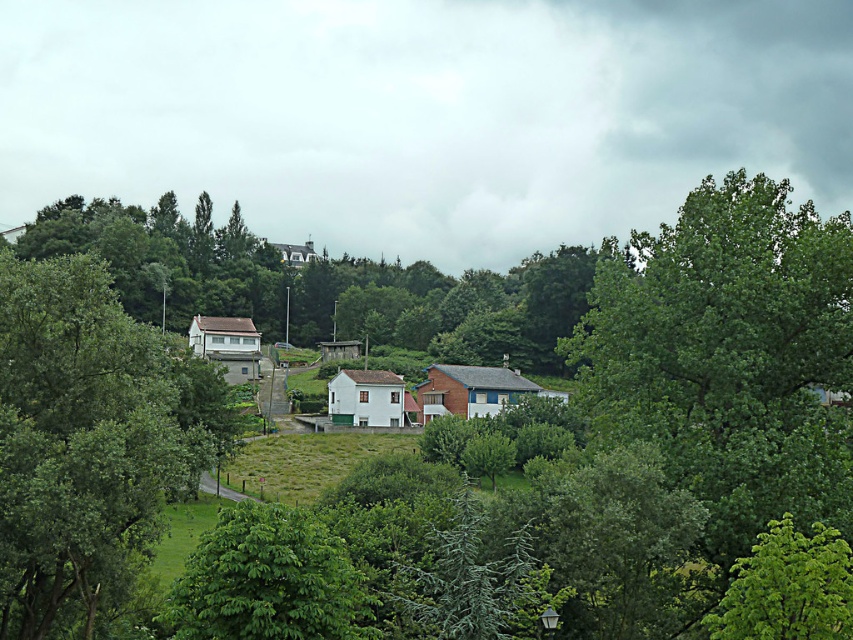
You are a hiker planning to take a photo of the green leafy tree at center and the green leafy tree at lower right from the path. Which tree should you stand closer to in order to capture both trees in the same frame without zooming?

You should stand closer to the green leafy tree at lower right because it is smaller than the green leafy tree at center, allowing both to fit in the frame when positioned nearer to the smaller tree.

You are a bird flying over the rural landscape and want to land on a tree. If you choose between the green leafy tree at center and the green leafy tree at lower right, which one is higher up in the scene?

The green leafy tree at center is positioned over the green leafy tree at lower right, so it is higher up in the scene.